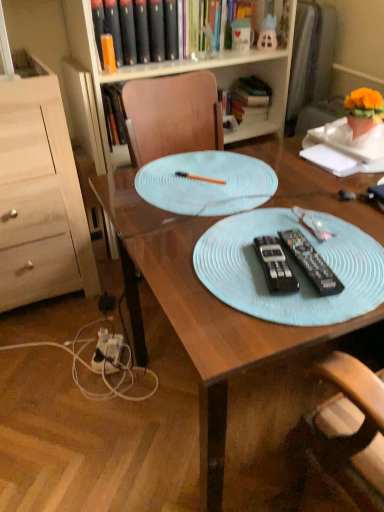
Locate an element on the screen. The width and height of the screenshot is (384, 512). vacant space that's between orange fabric flower pot at upper right and black plastic remote control at center, marked as the second remote control in a right-to-left arrangement is located at coordinates (323, 195).